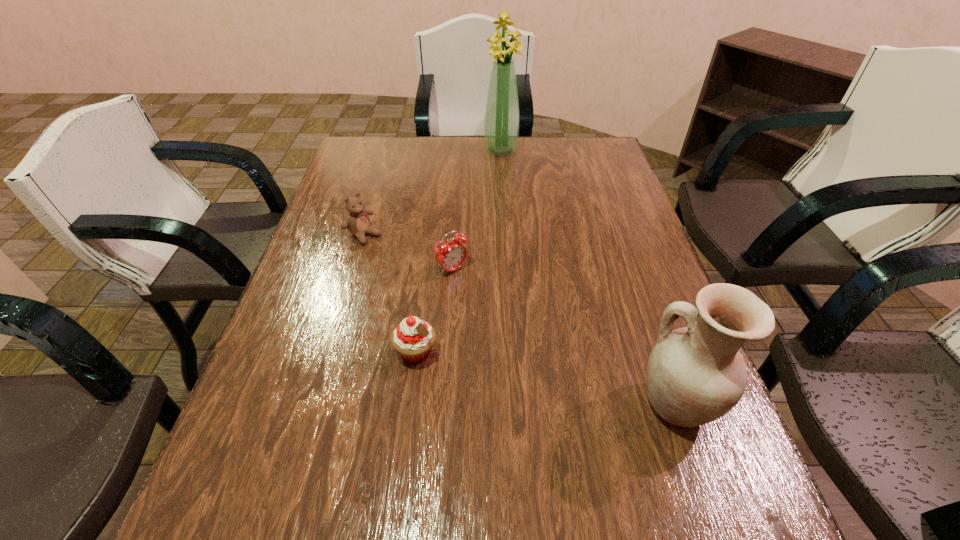
The image size is (960, 540). In order to click on object that is at the near edge in this screenshot , I will do `click(695, 374)`.

Where is `object that is positioned at the left edge`? object that is positioned at the left edge is located at coordinates (358, 222).

This screenshot has width=960, height=540. What are the coordinates of `object located in the right edge section of the desktop` in the screenshot? It's located at (695, 374).

Image resolution: width=960 pixels, height=540 pixels. Find the location of `object present at the near right corner`. object present at the near right corner is located at coordinates (695, 374).

The image size is (960, 540). Find the location of `free space at the far edge of the desktop`. free space at the far edge of the desktop is located at coordinates (426, 145).

Where is `vacant space at the left edge`? This screenshot has height=540, width=960. vacant space at the left edge is located at coordinates (332, 227).

What are the coordinates of `vacant space at the right edge of the desktop` in the screenshot? It's located at (647, 244).

Find the location of `vacant space at the far left corner of the desktop`. vacant space at the far left corner of the desktop is located at coordinates (367, 169).

In the image, there is a desktop. In order to click on vacant space at the far right corner in this screenshot , I will do `click(587, 154)`.

Locate an element on the screen. The image size is (960, 540). unoccupied area between the rightmost object and the fourth object from left to right is located at coordinates (588, 277).